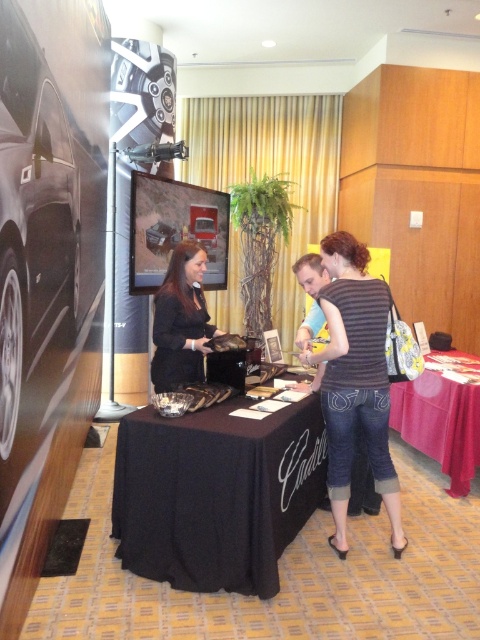
Where is `black cloth table at center`? The image size is (480, 640). black cloth table at center is located at coordinates (216, 493).

Which is behind, point (162, 486) or point (459, 467)?

The point (459, 467) is behind.

Is point (259, 493) farther from camera compared to point (415, 385)?

No, (259, 493) is in front of (415, 385).

The image size is (480, 640). Identify the location of black cloth table at center. (216, 493).

Who is shorter, striped fabric shirt at center or black matte dress at center?

With less height is black matte dress at center.

Who is positioned more to the left, striped fabric shirt at center or black matte dress at center?

From the viewer's perspective, black matte dress at center appears more on the left side.

Which is behind, point (327, 304) or point (180, 355)?

Point (180, 355)

Image resolution: width=480 pixels, height=640 pixels. What are the coordinates of `striped fabric shirt at center` in the screenshot? It's located at (355, 381).

Which is more to the left, black cloth table at center or black matte dress at center?

black matte dress at center is more to the left.

Describe the element at coordinates (216, 493) in the screenshot. I see `black cloth table at center` at that location.

Is point (276, 492) farther from viewer compared to point (168, 349)?

That is False.

The image size is (480, 640). I want to click on black cloth table at center, so click(x=216, y=493).